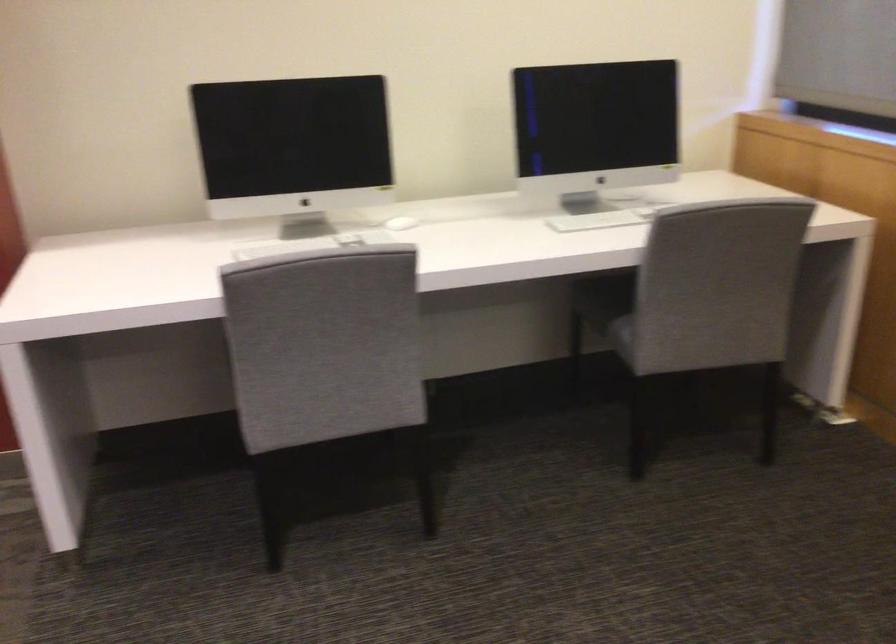
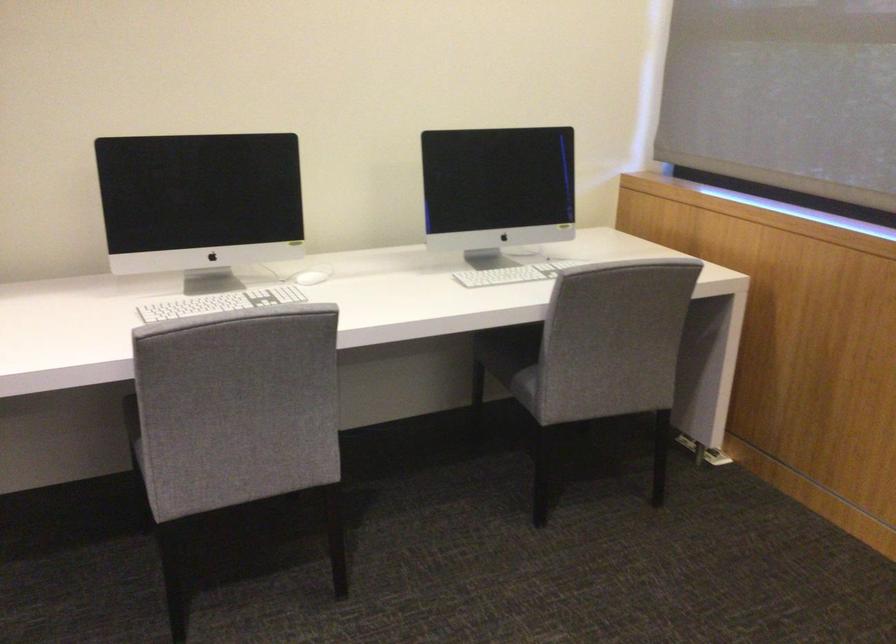
In the second image, find the point that corresponds to the point at 619,213 in the first image.

(519, 270)